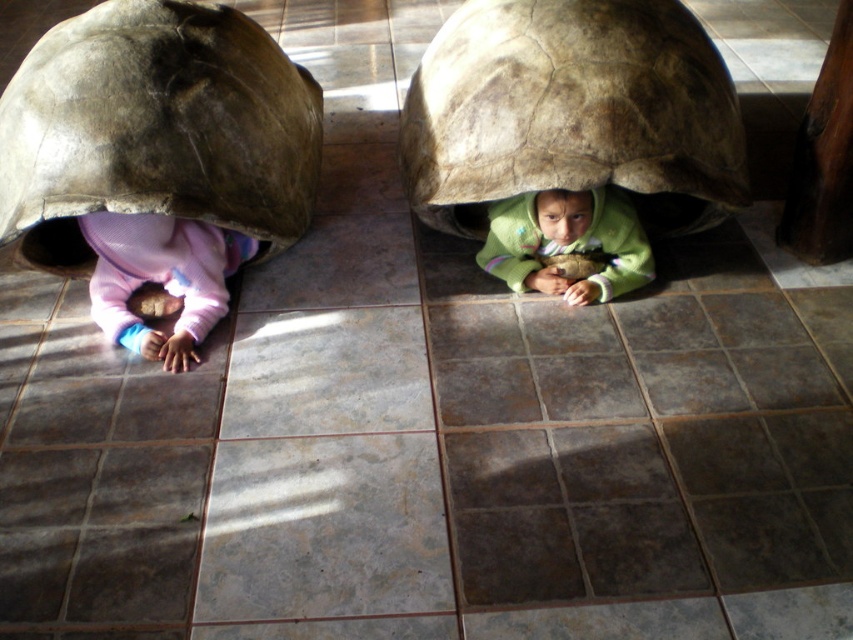
Question: Can you confirm if pink fleece baby at lower left is positioned above green fleece jacket at center?

Choices:
 (A) no
 (B) yes

Answer: (A)

Question: Which object appears closest to the camera in this image?

Choices:
 (A) matte brown tortoise shell at lower left
 (B) leather-like brown tortoise shell at center

Answer: (A)

Question: Is matte brown tortoise shell at lower left to the right of green fleece jacket at center from the viewer's perspective?

Choices:
 (A) yes
 (B) no

Answer: (B)

Question: Estimate the real-world distances between objects in this image. Which object is farther from the matte brown tortoise shell at lower left?

Choices:
 (A) green fleece jacket at center
 (B) leather-like brown tortoise shell at center
 (C) pink fleece baby at lower left

Answer: (A)

Question: Which of the following is the farthest from the observer?

Choices:
 (A) (572, 234)
 (B) (277, 179)

Answer: (B)

Question: Is pink fleece baby at lower left above green fleece jacket at center?

Choices:
 (A) no
 (B) yes

Answer: (A)